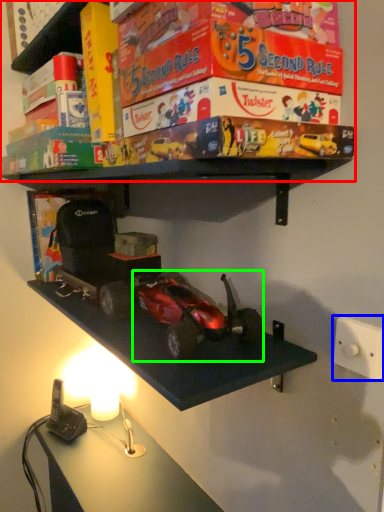
Question: Which is farther away from shelf (highlighted by a red box)? light switch (highlighted by a blue box) or model car (highlighted by a green box)?

Choices:
 (A) light switch
 (B) model car

Answer: (A)